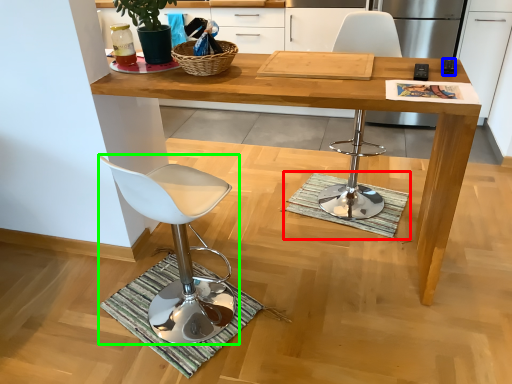
Question: Which object is positioned farthest from doormat (highlighted by a red box)? Select from remote control (highlighted by a blue box) and chair (highlighted by a green box).

Choices:
 (A) remote control
 (B) chair

Answer: (A)